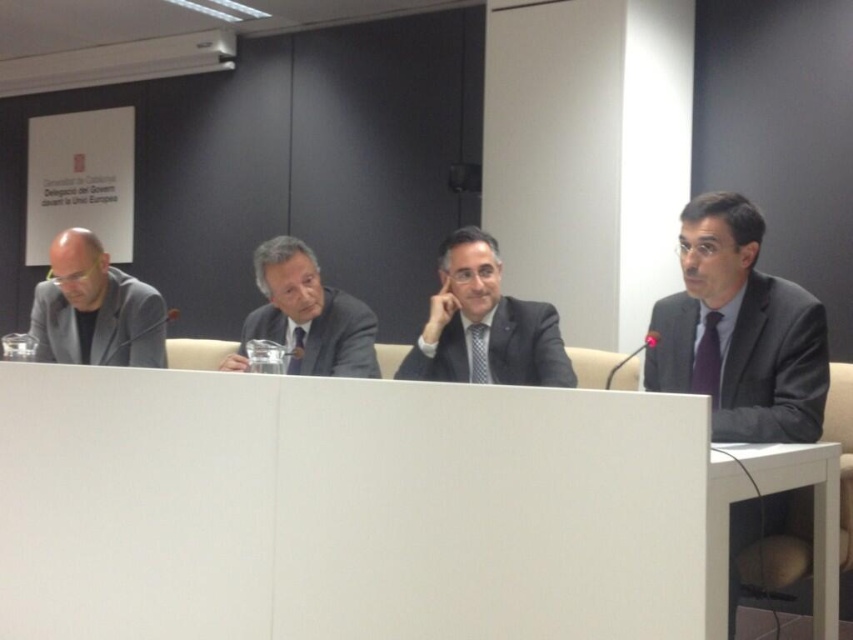
Question: Which object appears closest to the camera in this image?

Choices:
 (A) matte black suit at center
 (B) matte black suit at right
 (C) dark gray suit at center

Answer: (B)

Question: Which of the following is the closest to the observer?

Choices:
 (A) (811, 584)
 (B) (141, 291)
 (C) (526, 358)

Answer: (A)

Question: Does white matte table at center have a lesser width compared to matte black suit at center?

Choices:
 (A) no
 (B) yes

Answer: (A)

Question: Where is white matte table at center located in relation to dark gray suit at center in the image?

Choices:
 (A) below
 (B) above

Answer: (A)

Question: Which object appears farthest from the camera in this image?

Choices:
 (A) dark gray suit at center
 (B) white matte table at center
 (C) matte black suit at right
 (D) matte black suit at center

Answer: (A)

Question: Can you confirm if matte black suit at center is positioned below dark gray suit at center?

Choices:
 (A) no
 (B) yes

Answer: (B)